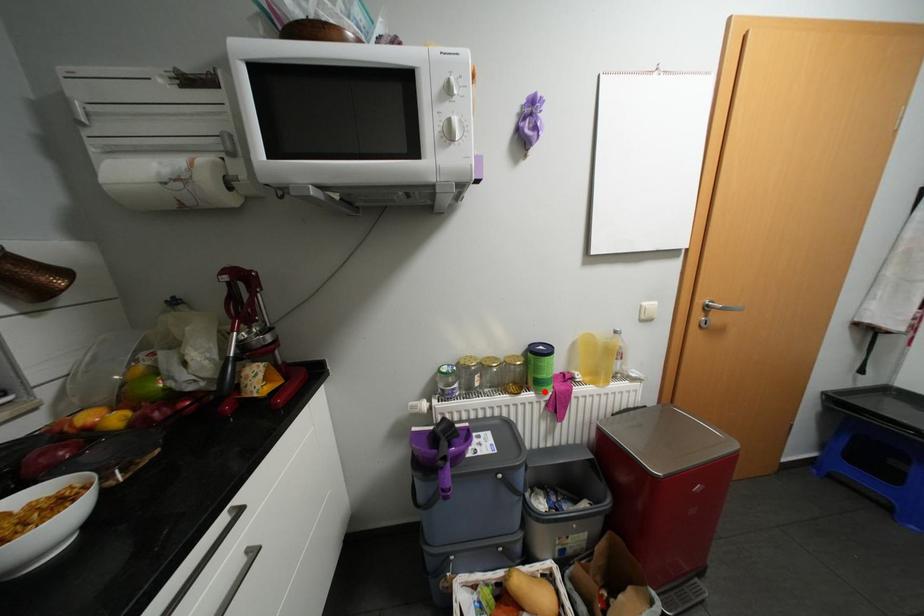
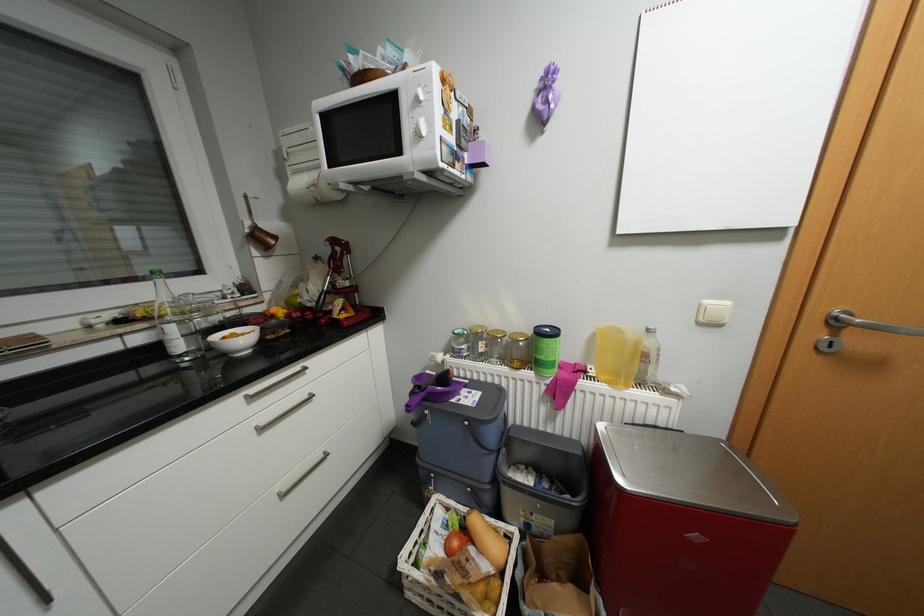
Where in the second image is the point corresponding to the highlighted location from the first image?

(544, 373)